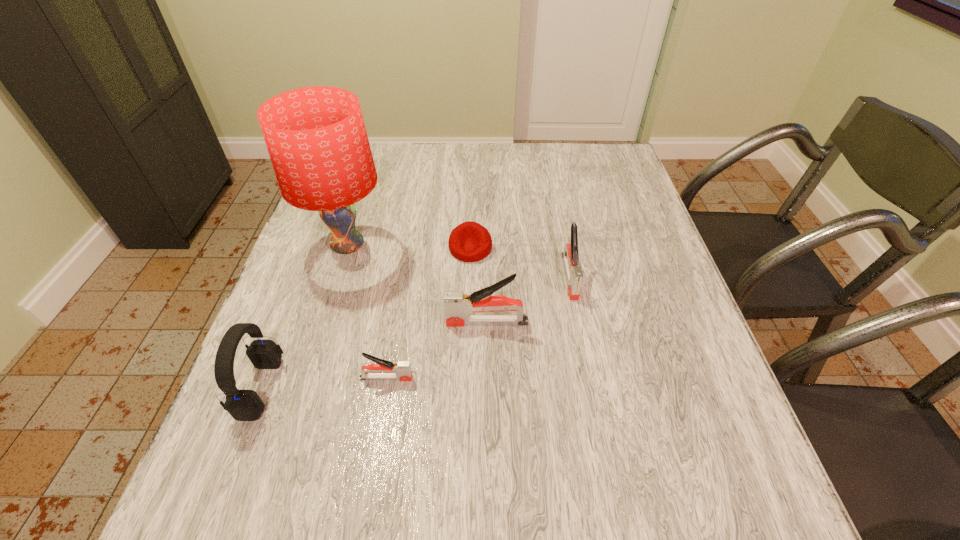
Identify the location of the second closest stapler to the beanbag. The image size is (960, 540). (574, 274).

Identify the location of vacant point that satisfies the following two spatial constraints: 1. on the handle side of the second shortest stapler; 2. on the handle side of the second farthest stapler. This screenshot has height=540, width=960. (579, 322).

You are a GUI agent. You are given a task and a screenshot of the screen. Output one action in this format:
    pyautogui.click(x=<x>, y=<y>)
    Task: Click on the vacant space that satisfies the following two spatial constraints: 1. on the handle side of the second tallest stapler; 2. on the handle side of the second stapler from left to right
    This screenshot has height=540, width=960.
    Given the screenshot: What is the action you would take?
    pyautogui.click(x=579, y=322)

At what (x,y) coordinates should I click in order to perform the action: click on blank space that satisfies the following two spatial constraints: 1. on the seat area of the beanbag; 2. on the handle side of the nearest stapler. Please return your answer as a coordinate pair (x, y). This screenshot has height=540, width=960. Looking at the image, I should click on (468, 378).

Locate an element on the screen. The width and height of the screenshot is (960, 540). free space that satisfies the following two spatial constraints: 1. on the handle side of the fourth tallest object; 2. on the handle side of the fourth farthest object is located at coordinates (579, 322).

Find the location of a particular element. Image resolution: width=960 pixels, height=540 pixels. free location that satisfies the following two spatial constraints: 1. on the seat area of the shortest object; 2. on the handle side of the fifth tallest object is located at coordinates click(468, 378).

Where is `free point that satisfies the following two spatial constraints: 1. on the handle side of the rightmost stapler; 2. on the handle side of the nearest stapler`? free point that satisfies the following two spatial constraints: 1. on the handle side of the rightmost stapler; 2. on the handle side of the nearest stapler is located at coordinates (589, 378).